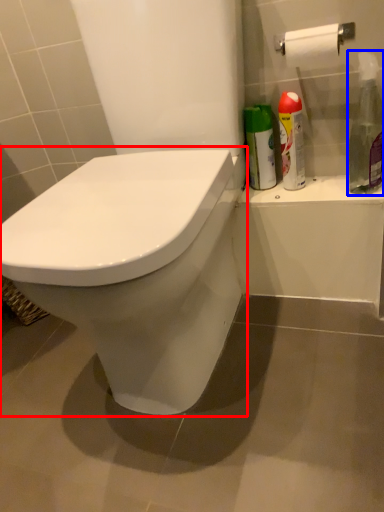
Question: Which object is further to the camera taking this photo, toilet (highlighted by a red box) or cleaning product (highlighted by a blue box)?

Choices:
 (A) toilet
 (B) cleaning product

Answer: (B)